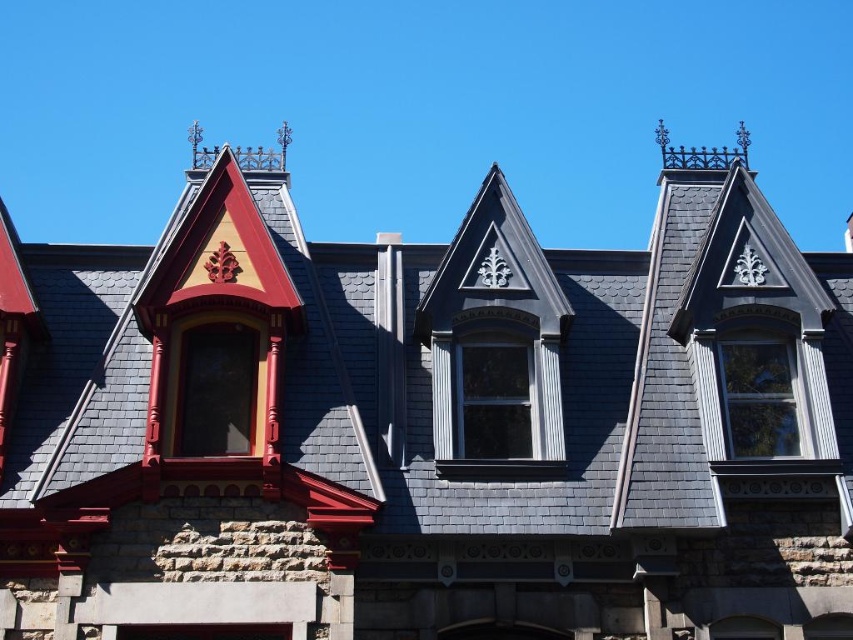
You are standing 40 meters away from the gray slate roof at upper center. Can you safely walk towards it without any obstacles?

The distance between you and the gray slate roof at upper center is 40.61 meters, so yes, you can safely walk towards it as there are no obstacles mentioned in the scene.

You are a window installer assessing the building. You need to determine if the clear glass window at center can be replaced with a larger one. Given the gray slate roof at upper center is wider than the current window, is there enough space to install a wider window without altering the roof?

The gray slate roof at upper center is wider than the clear glass window at center, so there is sufficient space to install a wider window without needing to modify the roof.